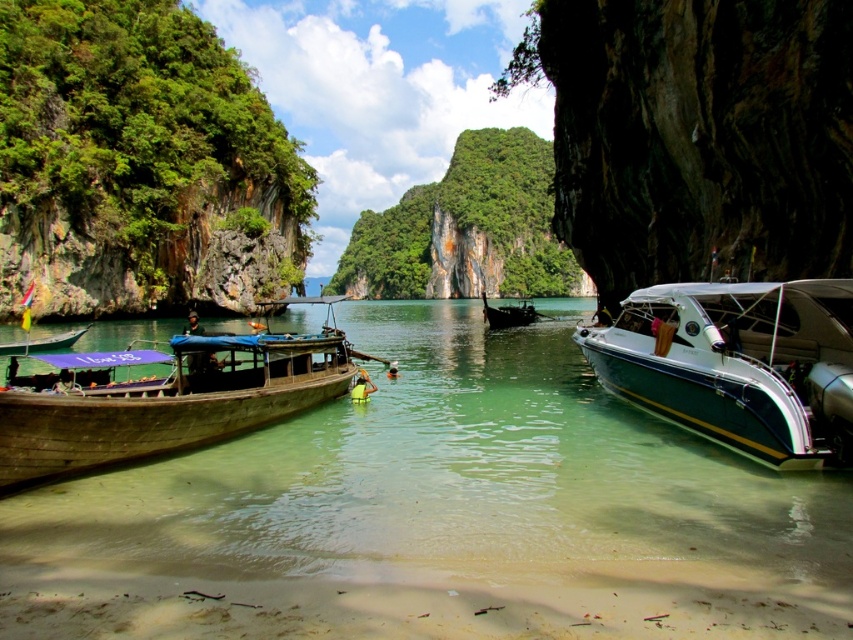
Who is shorter, white glossy motorboat at right or wooden boat at left?

white glossy motorboat at right is shorter.

What are the coordinates of `white glossy motorboat at right` in the screenshot? It's located at (740, 365).

Locate an element on the screen. white glossy motorboat at right is located at coordinates (740, 365).

Is point (428, 497) less distant than point (683, 348)?

Yes.

This screenshot has width=853, height=640. What are the coordinates of `clear water at center` in the screenshot? It's located at (438, 515).

Does clear water at center have a greater height compared to green wooden boat at left?

Yes.

Which is in front, point (184, 481) or point (44, 342)?

Point (184, 481)

Image resolution: width=853 pixels, height=640 pixels. Find the location of `clear water at center`. clear water at center is located at coordinates (438, 515).